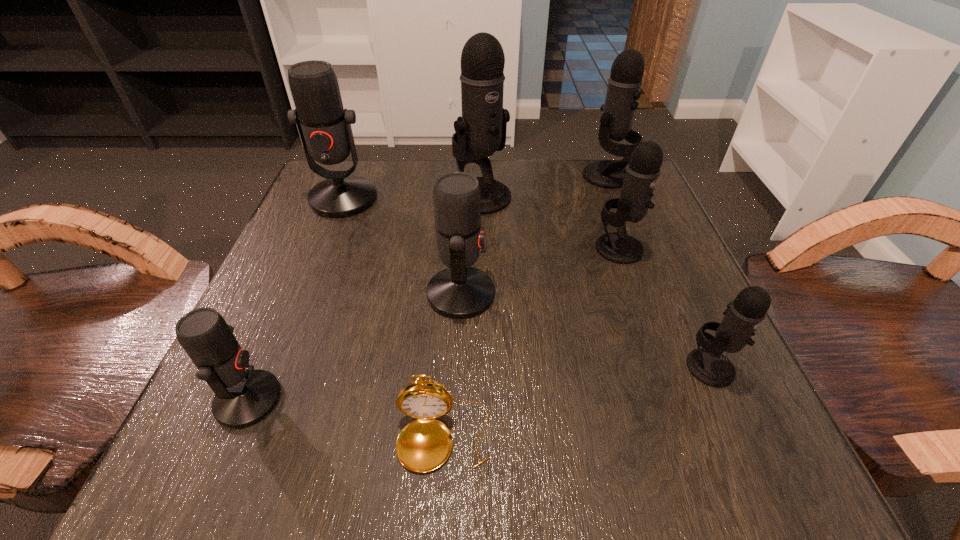
You are a GUI agent. You are given a task and a screenshot of the screen. Output one action in this format:
    pyautogui.click(x=<x>, y=<y>)
    Task: Click on the microphone object that ranks as the seventh closest to the pocket watch
    The image size is (960, 540).
    Given the screenshot: What is the action you would take?
    pyautogui.click(x=625, y=81)

Where is `the fourth closest black microphone relative to the nearest red microphone`? The height and width of the screenshot is (540, 960). the fourth closest black microphone relative to the nearest red microphone is located at coordinates (625, 81).

Image resolution: width=960 pixels, height=540 pixels. In order to click on black microphone that is the closest to the smallest red microphone in this screenshot , I will do (481, 131).

Identify which red microphone is the second nearest to the nearest red microphone. Please provide its 2D coordinates. Your answer should be formatted as a tuple, i.e. [(x, y)], where the tuple contains the x and y coordinates of a point satisfying the conditions above.

[(324, 126)]

Where is `red microphone that can be found as the second closest to the second nearest red microphone`? red microphone that can be found as the second closest to the second nearest red microphone is located at coordinates (243, 396).

Locate an element on the screen. The image size is (960, 540). free space that satisfies the following two spatial constraints: 1. on the side of the rightmost red microphone with the red ring; 2. on the back side of the smallest black microphone is located at coordinates (458, 367).

Identify the location of free region that satisfies the following two spatial constraints: 1. on the side of the fifth farthest object with the red ring; 2. on the face of the pocket watch. (455, 438).

I want to click on free space in the image that satisfies the following two spatial constraints: 1. on the front side of the third smallest black microphone; 2. on the side of the nearest red microphone with the red ring, so click(x=694, y=400).

Find the location of `free space that satisfies the following two spatial constraints: 1. on the back side of the second biggest black microphone; 2. on the left side of the fourth farthest microphone`. free space that satisfies the following two spatial constraints: 1. on the back side of the second biggest black microphone; 2. on the left side of the fourth farthest microphone is located at coordinates (594, 176).

I want to click on blank space that satisfies the following two spatial constraints: 1. on the side of the fourth nearest object with the red ring; 2. on the face of the pocket watch, so click(x=455, y=438).